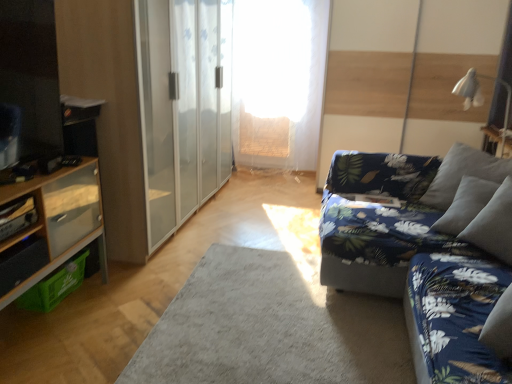
Question: Considering the relative positions of white fabric lampshade at upper right and wooden cabinet at left in the image provided, is white fabric lampshade at upper right to the left of wooden cabinet at left from the viewer's perspective?

Choices:
 (A) yes
 (B) no

Answer: (B)

Question: Is wooden cabinet at left at the back of white fabric lampshade at upper right?

Choices:
 (A) no
 (B) yes

Answer: (A)

Question: Could you tell me if white fabric lampshade at upper right is turned towards wooden cabinet at left?

Choices:
 (A) yes
 (B) no

Answer: (B)

Question: From a real-world perspective, is white fabric lampshade at upper right located beneath wooden cabinet at left?

Choices:
 (A) no
 (B) yes

Answer: (A)

Question: Does white fabric lampshade at upper right lie behind wooden cabinet at left?

Choices:
 (A) no
 (B) yes

Answer: (B)

Question: Is white fabric lampshade at upper right directly adjacent to wooden cabinet at left?

Choices:
 (A) yes
 (B) no

Answer: (B)

Question: Is the surface of wooden cabinet at left in direct contact with transparent fabric at center?

Choices:
 (A) yes
 (B) no

Answer: (B)

Question: Is wooden cabinet at left looking in the opposite direction of transparent fabric at center?

Choices:
 (A) no
 (B) yes

Answer: (A)

Question: From the image's perspective, would you say wooden cabinet at left is positioned over transparent fabric at center?

Choices:
 (A) no
 (B) yes

Answer: (A)

Question: Does wooden cabinet at left come in front of transparent fabric at center?

Choices:
 (A) no
 (B) yes

Answer: (B)

Question: From a real-world perspective, is wooden cabinet at left located higher than transparent fabric at center?

Choices:
 (A) yes
 (B) no

Answer: (B)

Question: Can you confirm if wooden cabinet at left is positioned to the left of transparent fabric at center?

Choices:
 (A) no
 (B) yes

Answer: (B)

Question: Can you confirm if blue floral fabric couch at right is smaller than wooden cabinet at left?

Choices:
 (A) yes
 (B) no

Answer: (B)